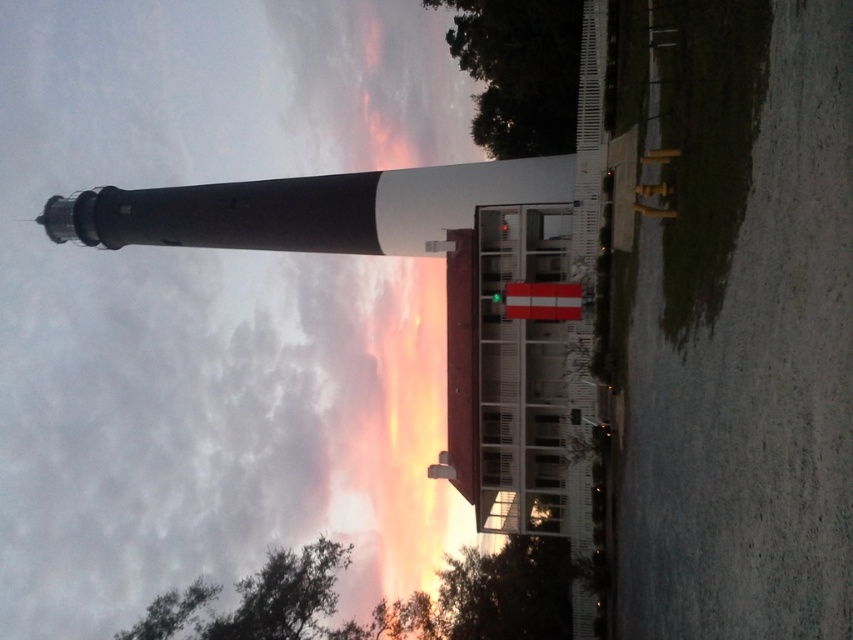
You are standing on the beach and see the cloudy sky at upper center and the smooth black lighthouse at left. Which object appears wider from your viewpoint?

The cloudy sky at upper center might be wider than the smooth black lighthouse at left according to the description.

You are standing at the base of the lighthouse and looking upward. What do you see at the point with coordinates point (213, 308)?

At the point (213, 308), you see cloudy sky at upper center.